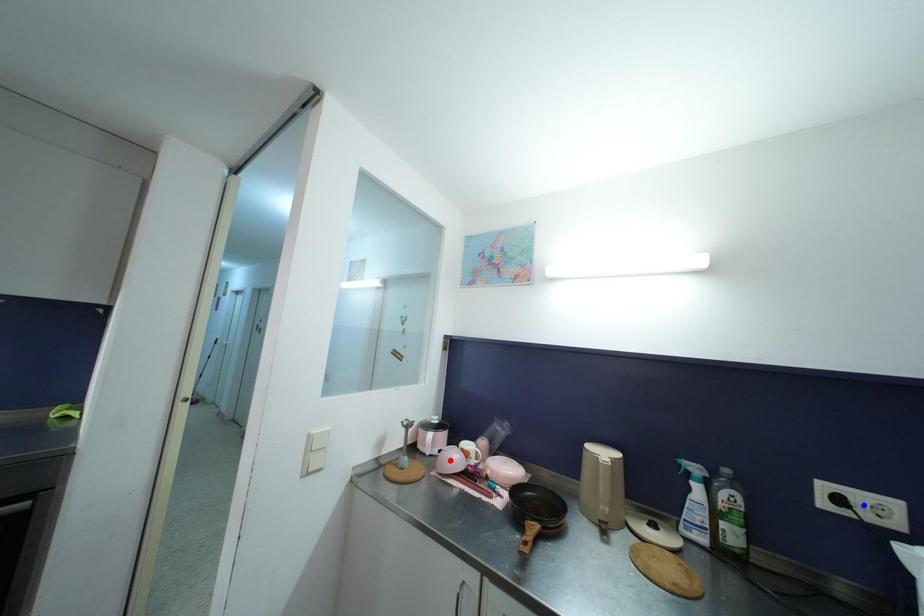
Question: In the image, two points are highlighted. Which point is nearer to the camera? Reply with the corresponding letter.

Choices:
 (A) blue point
 (B) red point

Answer: (A)